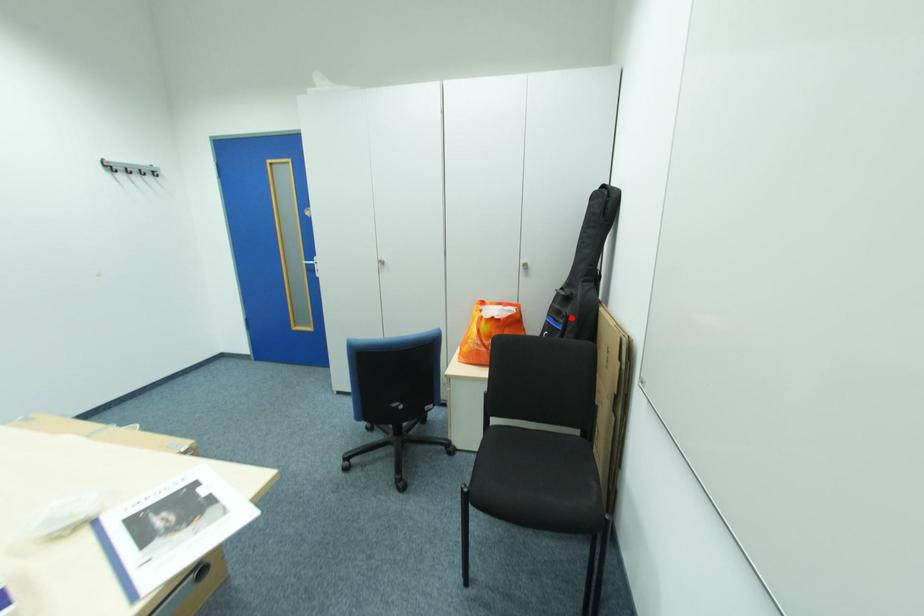
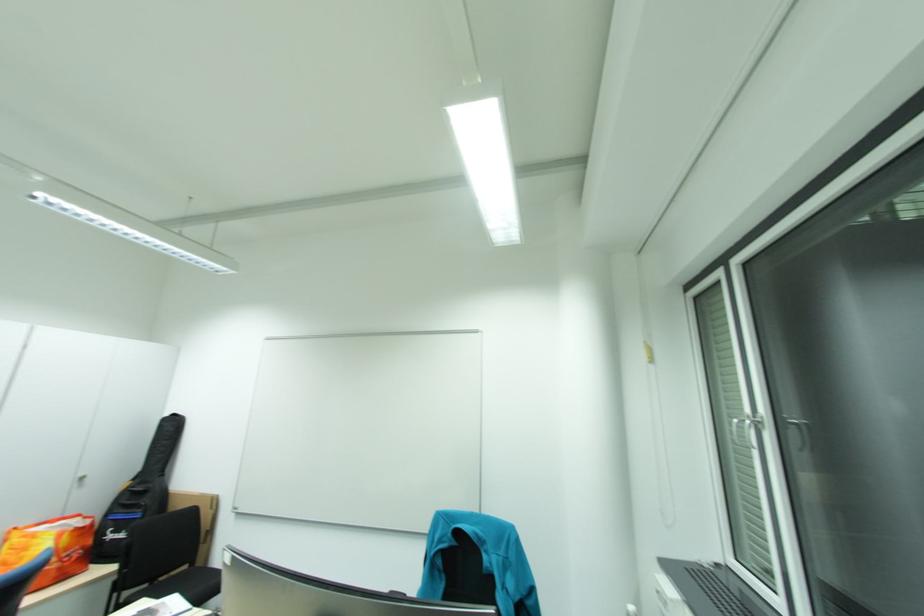
Question: I am providing you with two images of the same scene from different viewpoints. Image1 has a red point marked. In image2, the corresponding 3D location appears at what relative position? Reply with the corresponding letter.

Choices:
 (A) Closer
 (B) Farther

Answer: (A)